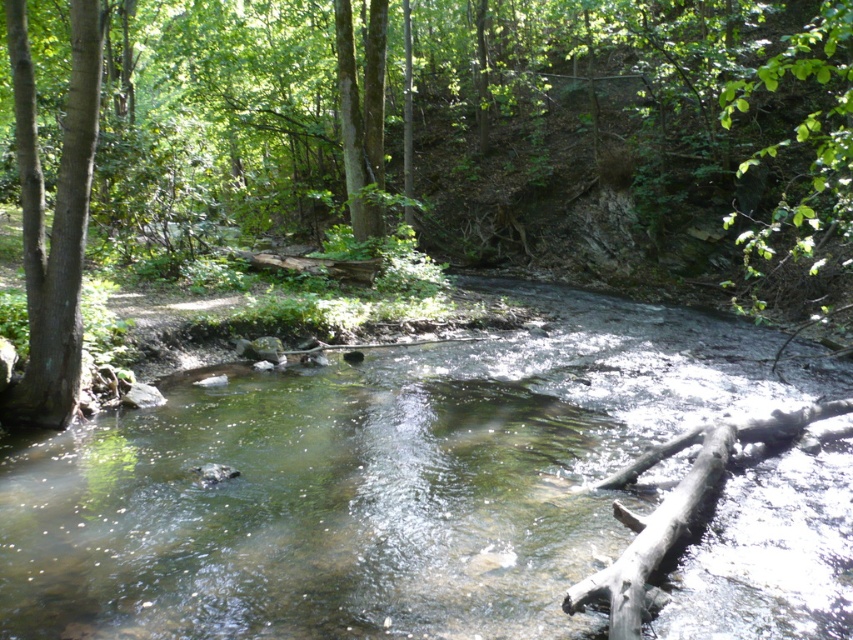
Question: Considering the real-world distances, which object is closest to the green leafy tree at center?

Choices:
 (A) clear water at center
 (B) gray rough log at lower right

Answer: (A)

Question: Which object appears farthest from the camera in this image?

Choices:
 (A) clear water at center
 (B) gray rough log at lower right
 (C) green leafy tree at center
 (D) green smooth tree trunk at left

Answer: (D)

Question: Which object is closer to the camera taking this photo?

Choices:
 (A) gray rough log at lower right
 (B) green leafy tree at center
 (C) clear water at center
 (D) green smooth tree trunk at left

Answer: (A)

Question: Is green smooth tree trunk at left bigger than gray rough log at lower right?

Choices:
 (A) no
 (B) yes

Answer: (A)

Question: Can you confirm if green smooth tree trunk at left is positioned to the left of gray rough log at lower right?

Choices:
 (A) yes
 (B) no

Answer: (A)

Question: Can you confirm if clear water at center is wider than gray rough log at lower right?

Choices:
 (A) yes
 (B) no

Answer: (A)